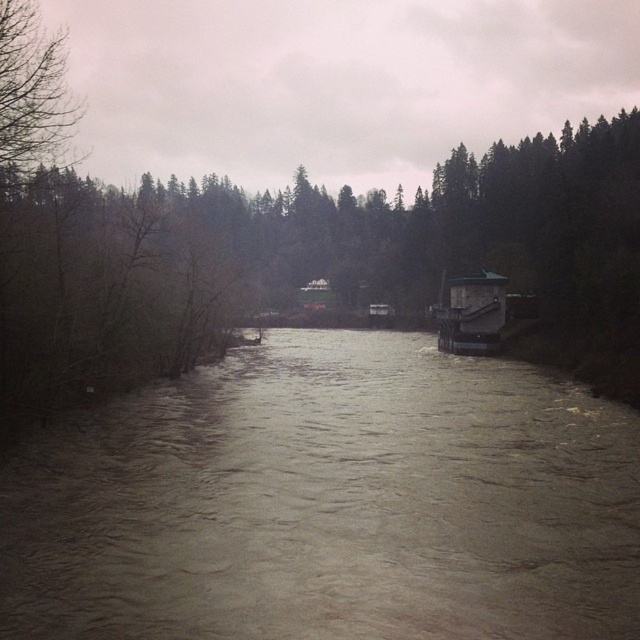
You are standing at the edge of the river in the image and want to take a photo of both point (22, 48) and point (440, 300). Which point should you focus on first to ensure both are in clear view?

You should focus on point (22, 48) first because it is closer to the camera than point (440, 300), ensuring both points are within the depth of field.

You are an artist sketching the river scene. You want to ensure the proportions between the brown matte tree at center and the bare branches at upper left are accurate. Which object should you draw larger in your sketch?

The brown matte tree at center should be drawn larger than the bare branches at upper left because it is much taller according to the description.